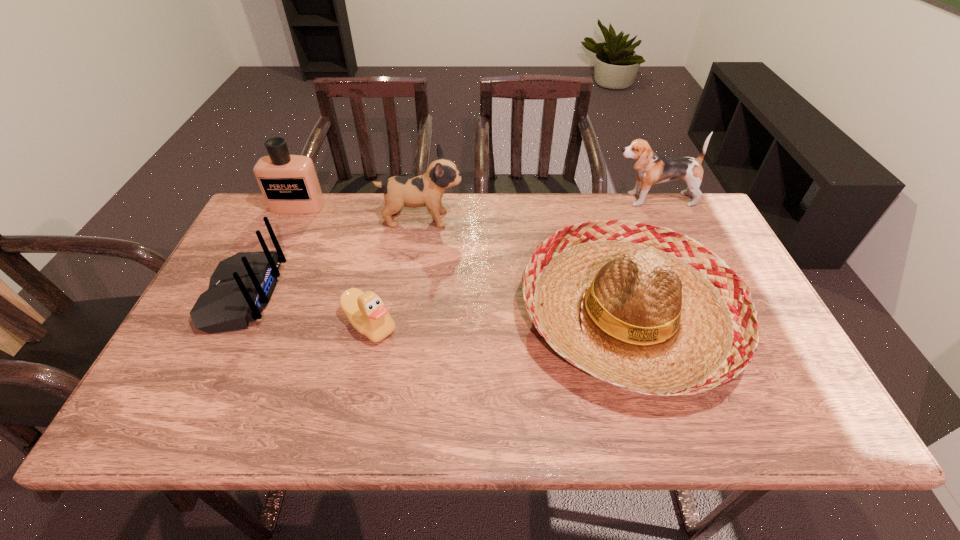
You are a GUI agent. You are given a task and a screenshot of the screen. Output one action in this format:
    pyautogui.click(x=<x>, y=<y>)
    Task: Click on the vacant area that lies between the sombrero and the nearer puppy
    The width and height of the screenshot is (960, 540).
    Given the screenshot: What is the action you would take?
    pyautogui.click(x=524, y=268)

Identify the location of free space between the left puppy and the perfume. (360, 213).

This screenshot has height=540, width=960. I want to click on free space between the sombrero and the fifth tallest object, so click(x=435, y=306).

Where is `free space between the left puppy and the perfume`? This screenshot has height=540, width=960. free space between the left puppy and the perfume is located at coordinates (360, 213).

I want to click on free space between the nearer puppy and the perfume, so click(x=360, y=213).

The width and height of the screenshot is (960, 540). Find the location of `vacant region between the shortest object and the farther puppy`. vacant region between the shortest object and the farther puppy is located at coordinates (511, 262).

The height and width of the screenshot is (540, 960). What are the coordinates of `blank region between the router and the duck` in the screenshot? It's located at (307, 310).

I want to click on vacant space that's between the perfume and the sombrero, so click(463, 261).

You are a GUI agent. You are given a task and a screenshot of the screen. Output one action in this format:
    pyautogui.click(x=<x>, y=<y>)
    Task: Click on the object that can be found as the second closest to the sombrero
    Image resolution: width=960 pixels, height=540 pixels.
    Given the screenshot: What is the action you would take?
    pyautogui.click(x=652, y=168)

Identify which object is the third closest to the shortest object. Please provide its 2D coordinates. Your answer should be formatted as a tuple, i.e. [(x, y)], where the tuple contains the x and y coordinates of a point satisfying the conditions above.

[(644, 308)]